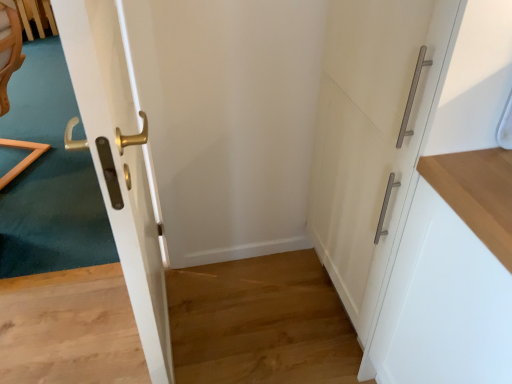
Question: Considering the relative positions of white matte cabinet handle at right, the second door in the left-to-right sequence, and white matte cabinet at right in the image provided, is white matte cabinet handle at right, the second door in the left-to-right sequence, to the left of white matte cabinet at right from the viewer's perspective?

Choices:
 (A) yes
 (B) no

Answer: (A)

Question: Is white matte cabinet handle at right, which appears as the 1th door when viewed from the right, outside of white matte cabinet at right?

Choices:
 (A) no
 (B) yes

Answer: (B)

Question: Is the surface of white matte cabinet handle at right, the second door in the left-to-right sequence, in direct contact with white matte cabinet at right?

Choices:
 (A) yes
 (B) no

Answer: (B)

Question: Is white matte cabinet handle at right, the second door in the left-to-right sequence, bigger than white matte cabinet at right?

Choices:
 (A) yes
 (B) no

Answer: (A)

Question: Does white matte cabinet handle at right, which appears as the 1th door when viewed from the right, have a lesser width compared to white matte cabinet at right?

Choices:
 (A) no
 (B) yes

Answer: (A)

Question: Relative to white matte cabinet handle at right, which appears as the 1th door when viewed from the right, is glossy white door at left, which is the second door from right to left, in front or behind?

Choices:
 (A) behind
 (B) front

Answer: (B)

Question: Which is correct: glossy white door at left, marked as the first door in a left-to-right arrangement, is inside white matte cabinet handle at right, which appears as the 1th door when viewed from the right, or outside of it?

Choices:
 (A) inside
 (B) outside

Answer: (B)

Question: From the image's perspective, is glossy white door at left, marked as the first door in a left-to-right arrangement, located above or below white matte cabinet handle at right, the second door in the left-to-right sequence?

Choices:
 (A) below
 (B) above

Answer: (A)

Question: Is glossy white door at left, which is the second door from right to left, bigger or smaller than white matte cabinet handle at right, which appears as the 1th door when viewed from the right?

Choices:
 (A) big
 (B) small

Answer: (B)

Question: From their relative heights in the image, would you say white matte cabinet handle at right, which appears as the 1th door when viewed from the right, is taller or shorter than glossy white door at left, which is the second door from right to left?

Choices:
 (A) tall
 (B) short

Answer: (B)

Question: Choose the correct answer: Is white matte cabinet handle at right, which appears as the 1th door when viewed from the right, inside glossy white door at left, which is the second door from right to left, or outside it?

Choices:
 (A) outside
 (B) inside

Answer: (A)

Question: From the image's perspective, relative to glossy white door at left, marked as the first door in a left-to-right arrangement, is white matte cabinet handle at right, the second door in the left-to-right sequence, above or below?

Choices:
 (A) above
 (B) below

Answer: (A)

Question: Looking at their shapes, would you say white matte cabinet handle at right, the second door in the left-to-right sequence, is wider or thinner than glossy white door at left, which is the second door from right to left?

Choices:
 (A) thin
 (B) wide

Answer: (B)

Question: Is white matte cabinet at right situated inside white matte cabinet handle at right, the second door in the left-to-right sequence, or outside?

Choices:
 (A) outside
 (B) inside

Answer: (A)

Question: Is point (498, 240) positioned closer to the camera than point (386, 254)?

Choices:
 (A) farther
 (B) closer

Answer: (B)